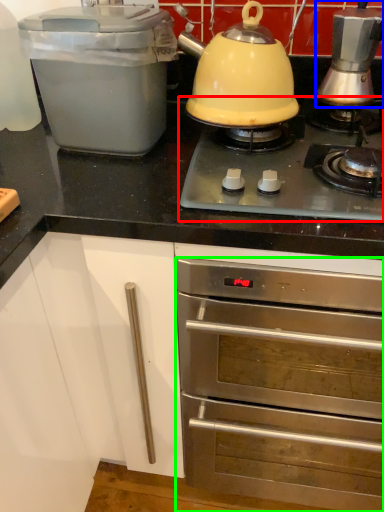
Question: Which object is positioned closest to gas stove (highlighted by a red box)? Select from kitchen appliance (highlighted by a blue box) and oven (highlighted by a green box).

Choices:
 (A) kitchen appliance
 (B) oven

Answer: (A)